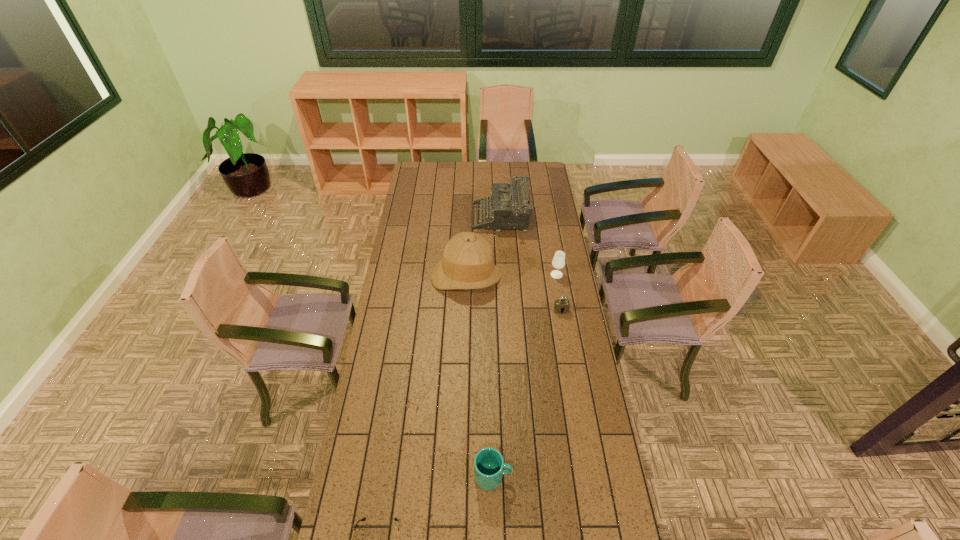
In order to click on object that stands as the second closest to the fourth farthest object in this screenshot , I will do pos(467,263).

The image size is (960, 540). What are the coordinates of `free space that satisfies the following two spatial constraints: 1. on the typing side of the farthest object; 2. on the back side of the glass` in the screenshot? It's located at (505, 274).

At what (x,y) coordinates should I click in order to perform the action: click on free location that satisfies the following two spatial constraints: 1. at the front of the second shortest object near the keyhole; 2. on the handle side of the fourth tallest object. Please return your answer as a coordinate pair (x, y). Looking at the image, I should click on (589, 476).

The width and height of the screenshot is (960, 540). I want to click on free space that satisfies the following two spatial constraints: 1. on the typing side of the fifth shortest object; 2. on the back side of the glass, so click(505, 274).

At what (x,y) coordinates should I click in order to perform the action: click on free spot that satisfies the following two spatial constraints: 1. on the typing side of the fifth shortest object; 2. on the back side of the glass. Please return your answer as a coordinate pair (x, y). The image size is (960, 540). Looking at the image, I should click on [x=505, y=274].

This screenshot has width=960, height=540. I want to click on vacant space that satisfies the following two spatial constraints: 1. on the back side of the glass; 2. on the typing side of the fifth shortest object, so click(x=547, y=219).